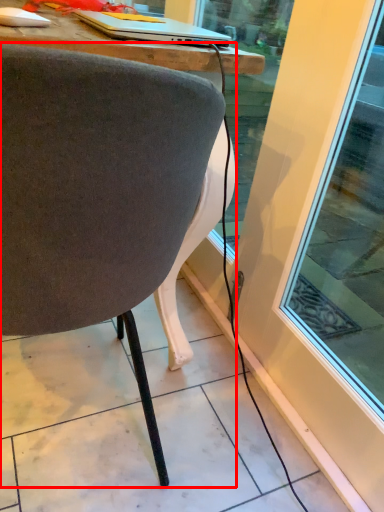
Question: Where is chair (annotated by the red box) located in relation to laptop in the image?

Choices:
 (A) left
 (B) right

Answer: (A)